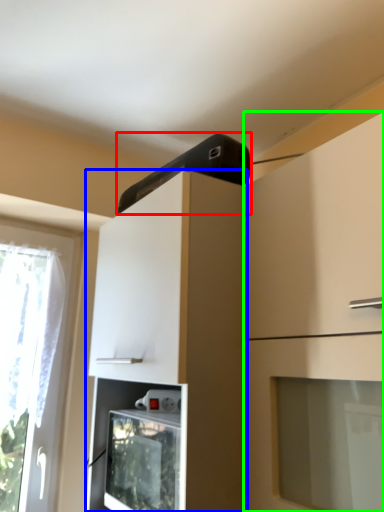
Question: Which object is the farthest from appliance (highlighted by a red box)? Choose among these: cabinetry (highlighted by a blue box) or cabinetry (highlighted by a green box).

Choices:
 (A) cabinetry
 (B) cabinetry

Answer: (B)